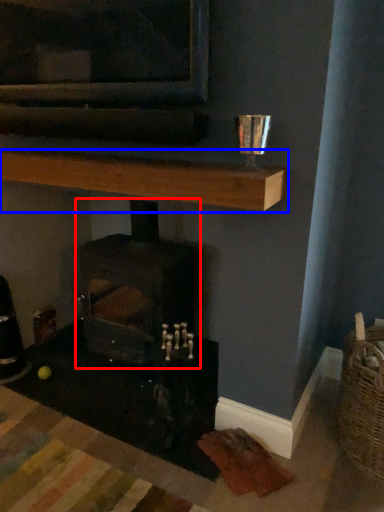
Question: Which point is closer to the camera, wood burning stove (highlighted by a red box) or shelf (highlighted by a blue box)?

Choices:
 (A) wood burning stove
 (B) shelf

Answer: (B)